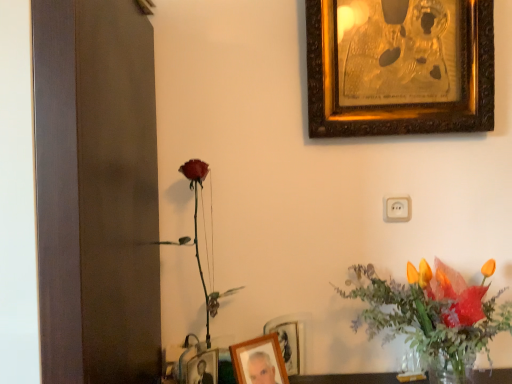
Question: Should I look upward or downward to see wooden photo frame at lower center, the first picture frame positioned from the left?

Choices:
 (A) up
 (B) down

Answer: (B)

Question: Does wooden photo frame at lower center, the second picture frame ordered from the bottom, have a lesser height compared to white plastic electric outlet at center?

Choices:
 (A) yes
 (B) no

Answer: (B)

Question: From the image's perspective, is wooden photo frame at lower center, the second picture frame ordered from the bottom, located above white plastic electric outlet at center?

Choices:
 (A) yes
 (B) no

Answer: (B)

Question: Can you confirm if wooden photo frame at lower center, which is the third picture frame in back-to-front order, is positioned to the right of white plastic electric outlet at center?

Choices:
 (A) no
 (B) yes

Answer: (A)

Question: Is wooden photo frame at lower center, which is the third picture frame in back-to-front order, wider than white plastic electric outlet at center?

Choices:
 (A) yes
 (B) no

Answer: (A)

Question: From the image's perspective, would you say wooden photo frame at lower center, the first picture frame positioned from the front, is shown under white plastic electric outlet at center?

Choices:
 (A) no
 (B) yes

Answer: (B)

Question: From a real-world perspective, is wooden photo frame at lower center, the first picture frame positioned from the left, located beneath white plastic electric outlet at center?

Choices:
 (A) yes
 (B) no

Answer: (A)

Question: From the image's perspective, is translucent glass vase at lower right located beneath wooden photo frame at lower center, which is counted as the third picture frame, starting from the right?

Choices:
 (A) yes
 (B) no

Answer: (B)

Question: Is translucent glass vase at lower right next to wooden photo frame at lower center, the second picture frame ordered from the bottom?

Choices:
 (A) no
 (B) yes

Answer: (A)

Question: Does translucent glass vase at lower right have a lesser width compared to wooden photo frame at lower center, which is the third picture frame in back-to-front order?

Choices:
 (A) yes
 (B) no

Answer: (B)

Question: From a real-world perspective, is translucent glass vase at lower right positioned under wooden photo frame at lower center, the 2th picture frame positioned from the top, based on gravity?

Choices:
 (A) yes
 (B) no

Answer: (B)

Question: Considering the relative sizes of translucent glass vase at lower right and wooden photo frame at lower center, the first picture frame positioned from the left, in the image provided, is translucent glass vase at lower right taller than wooden photo frame at lower center, the first picture frame positioned from the left,?

Choices:
 (A) yes
 (B) no

Answer: (A)

Question: Could you tell me if translucent glass vase at lower right is turned towards wooden photo frame at lower center, the first picture frame positioned from the front?

Choices:
 (A) no
 (B) yes

Answer: (A)

Question: Considering the relative sizes of white plastic electric outlet at center and wooden photo frame at lower center, the first picture frame in the bottom-to-top sequence, in the image provided, is white plastic electric outlet at center shorter than wooden photo frame at lower center, the first picture frame in the bottom-to-top sequence,?

Choices:
 (A) yes
 (B) no

Answer: (A)